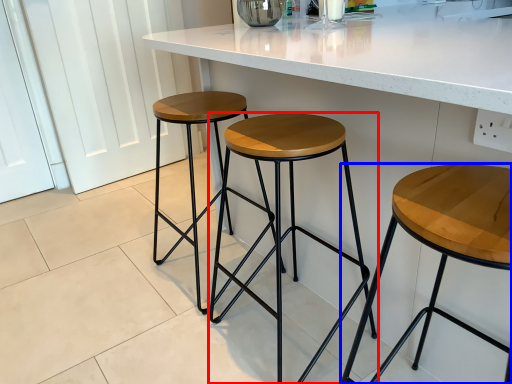
Question: Which of the following is the closest to the observer, stool (highlighted by a red box) or stool (highlighted by a blue box)?

Choices:
 (A) stool
 (B) stool

Answer: (B)